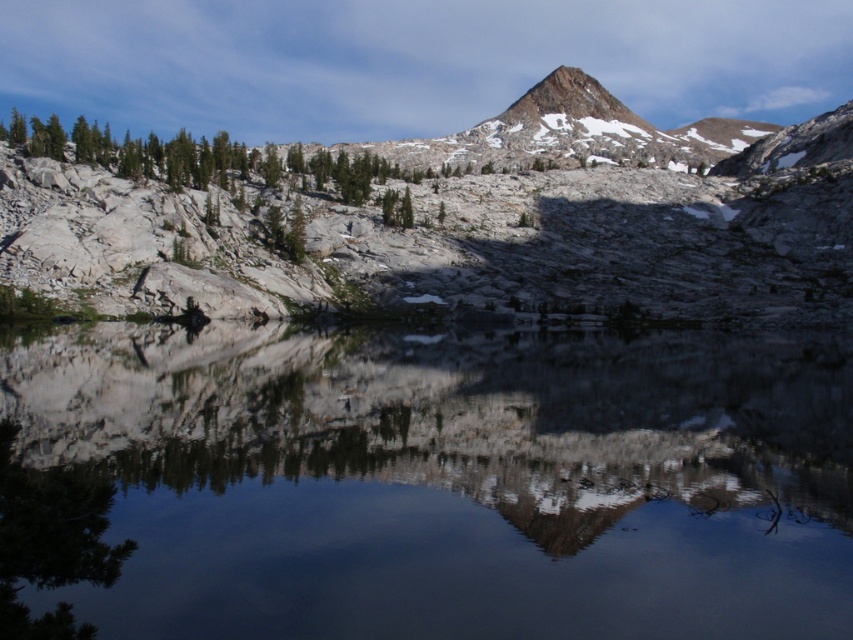
Which is more to the left, smooth reflective water at center or rugged granite mountain at upper center?

From the viewer's perspective, smooth reflective water at center appears more on the left side.

Which is above, smooth reflective water at center or rugged granite mountain at upper center?

Positioned higher is rugged granite mountain at upper center.

Which is behind, point (143, 488) or point (554, 205)?

Positioned behind is point (554, 205).

Image resolution: width=853 pixels, height=640 pixels. Find the location of `smooth reflective water at center`. smooth reflective water at center is located at coordinates (425, 483).

Is rugged granite mountain at upper center shorter than green matte tree at lower left?

No.

Can you confirm if rugged granite mountain at upper center is smaller than green matte tree at lower left?

No.

Between point (38, 186) and point (68, 492), which one is positioned in front?

Point (68, 492) is more forward.

Find the location of a particular element. rugged granite mountain at upper center is located at coordinates (445, 216).

Is smooth reflective water at center positioned at the back of green matte tree at lower left?

Yes, it is.

Consider the image. Does smooth reflective water at center appear over green matte tree at lower left?

Yes, smooth reflective water at center is above green matte tree at lower left.

At what (x,y) coordinates should I click in order to perform the action: click on smooth reflective water at center. Please return your answer as a coordinate pair (x, y). The height and width of the screenshot is (640, 853). Looking at the image, I should click on (425, 483).